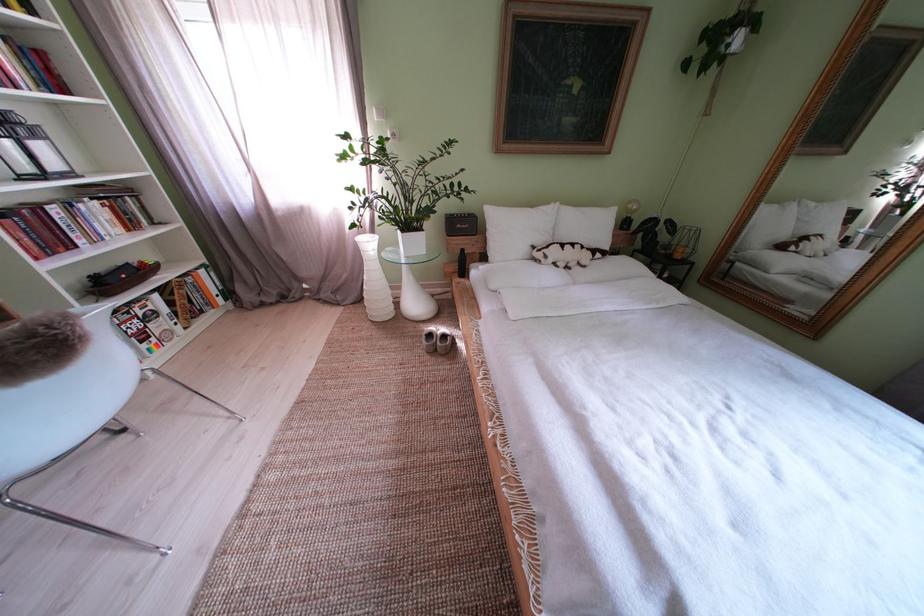
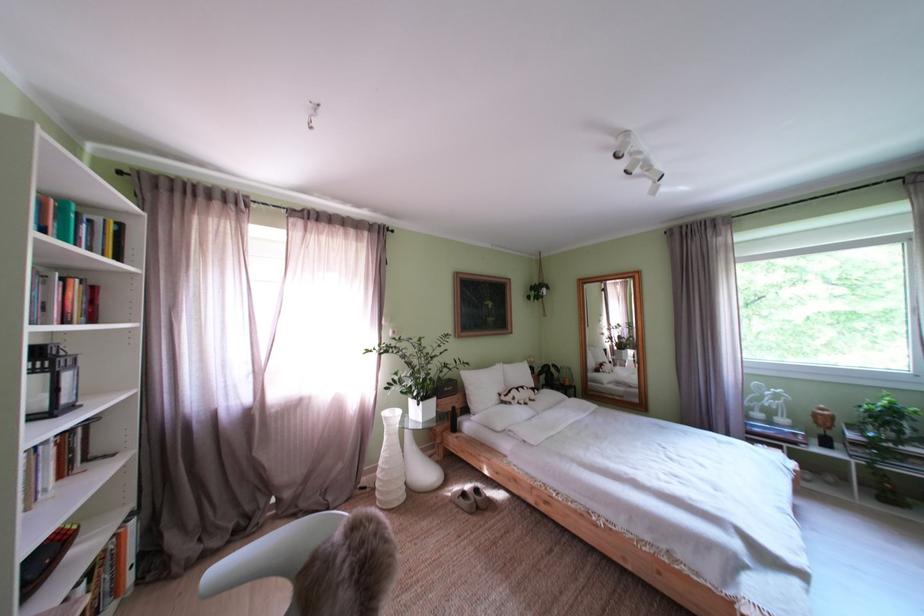
Find the pixel in the second image that matches [556,262] in the first image.

(525, 405)